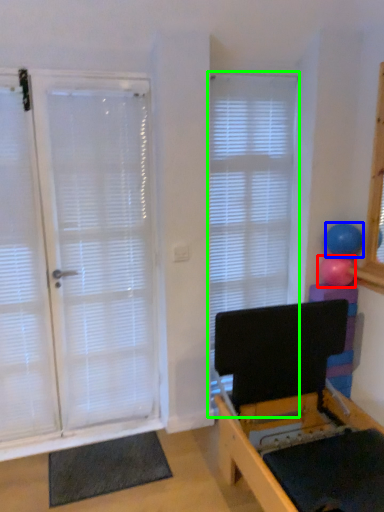
Question: Estimate the real-world distances between objects in this image. Which object is farther from ball (highlighted by a red box), ball (highlighted by a blue box) or window blind (highlighted by a green box)?

Choices:
 (A) ball
 (B) window blind

Answer: (B)